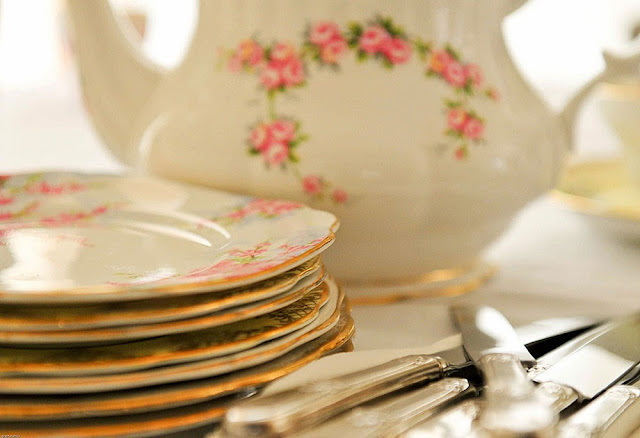
I want to click on silverware, so click(374, 374), click(404, 401), click(454, 411), click(512, 397), click(561, 390), click(592, 412).